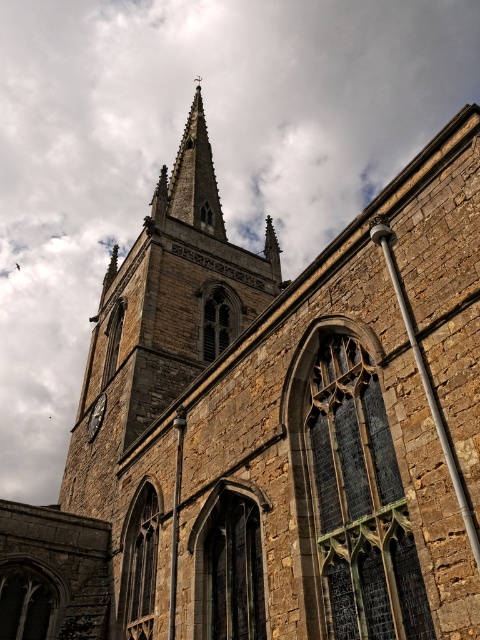
From the picture: You are an architect analyzing the church structure. You observe the stone steeple at center and the smooth stone spire at center. Which structure is taller?

The stone steeple at center is taller than the smooth stone spire at center.

You are a maintenance worker needing to inspect the stone steeple at center and the matte gray clock at lower left. Given that the ladder you have is 20 meters long, will it be sufficient to reach both objects from the ground?

The distance between the stone steeple at center and the matte gray clock at lower left is 22.43 meters. Since the ladder is only 20 meters long, it is not long enough to reach both objects from the ground.

You are standing in front of the historic stone church and want to take a photo that includes both the stone steeple at center and the matte gray clock at lower left. Which object should you focus on first if you want to ensure both are in the frame?

The stone steeple at center is much taller than the matte gray clock at lower left, so you should focus on the stone steeple at center first to ensure both are in the frame.